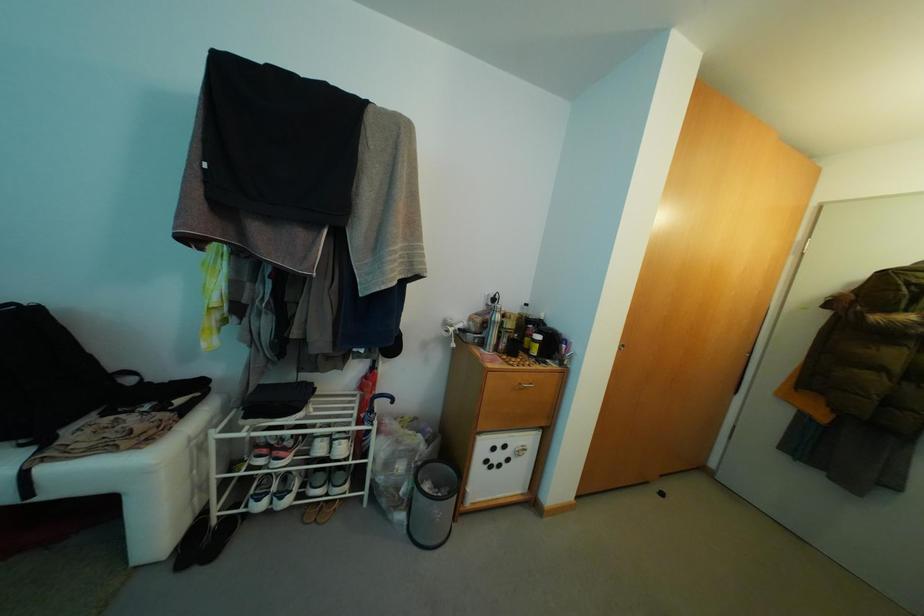
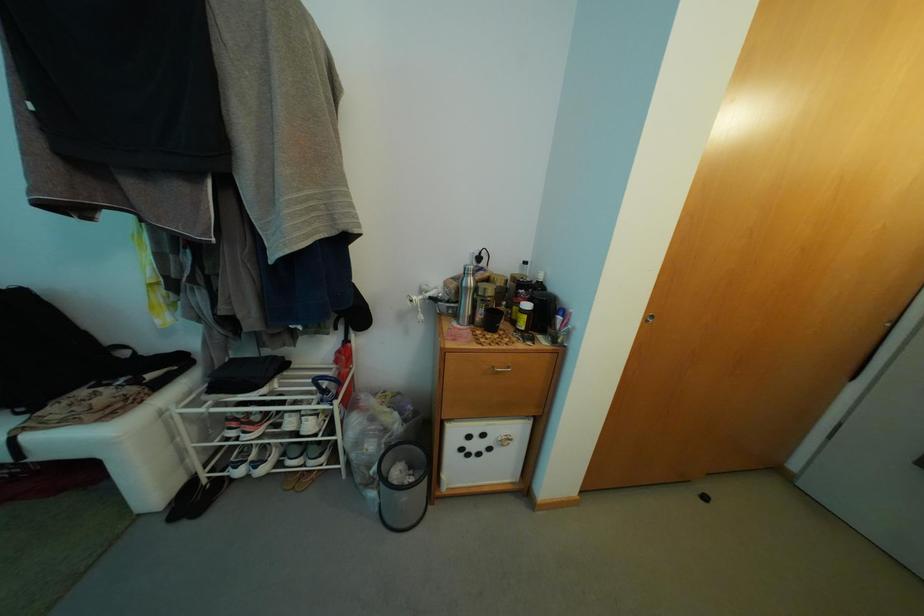
From the picture: In a continuous first-person perspective shot, in which direction is the camera moving?

The movement direction of the cameraman is right, forward.